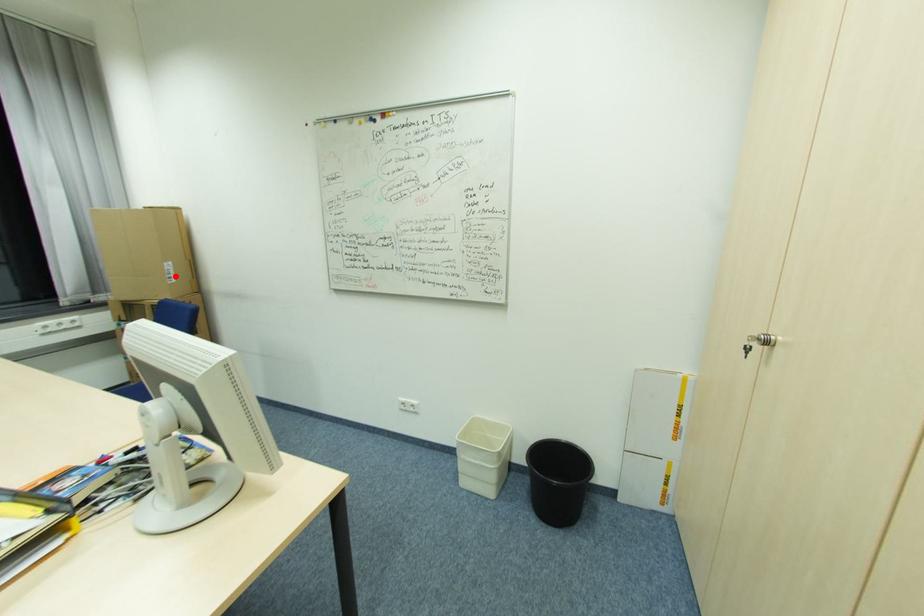
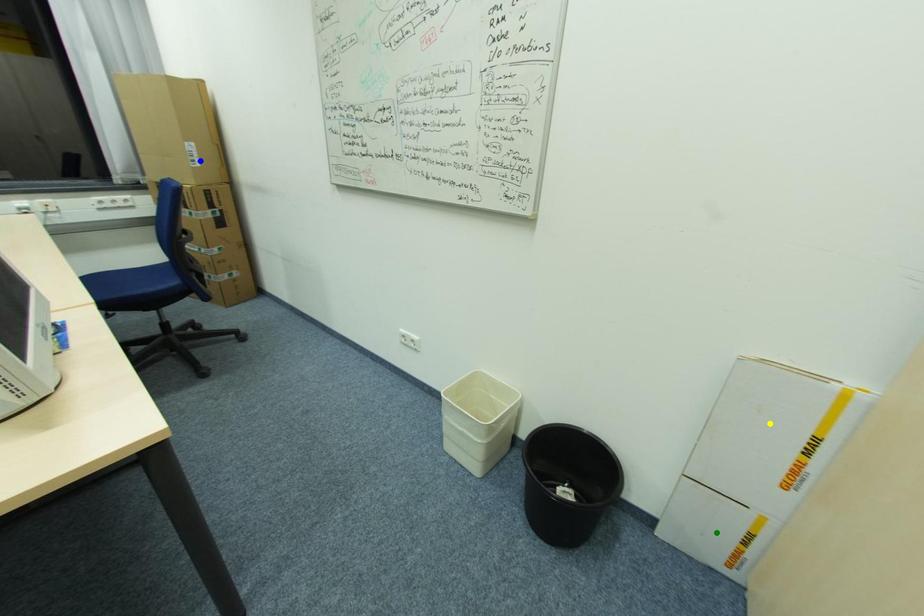
Question: I am providing you with two images of the same scene from different viewpoints. A red point is marked on the first image. You are given multiple points on the second image. Which spot in image 2 lines up with the point in image 1?

Choices:
 (A) blue point
 (B) green point
 (C) yellow point

Answer: (A)